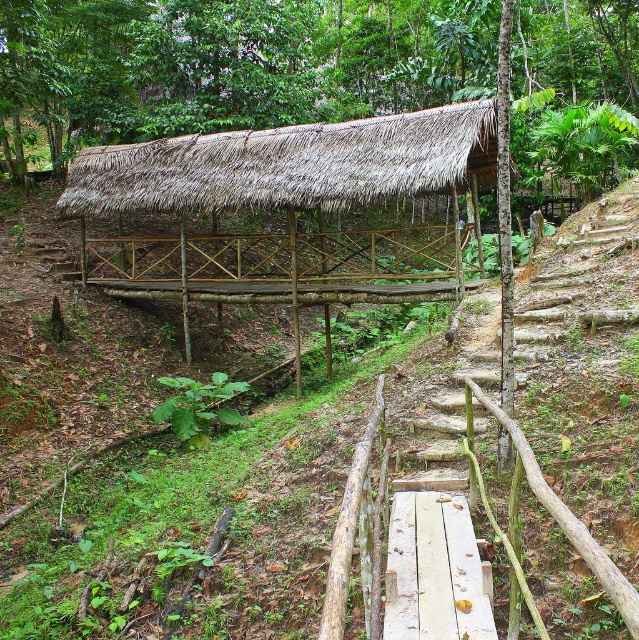
Question: Can you confirm if thatched roof hut at upper center is positioned below thatched roof shelter at center?

Choices:
 (A) no
 (B) yes

Answer: (A)

Question: Which of the following is the closest to the observer?

Choices:
 (A) thatched roof hut at upper center
 (B) thatched roof shelter at center

Answer: (B)

Question: Which point is closer to the camera taking this photo?

Choices:
 (A) (528, 10)
 (B) (273, 257)

Answer: (B)

Question: Which point is farther from the camera taking this photo?

Choices:
 (A) (82, 108)
 (B) (442, 262)

Answer: (A)

Question: Does thatched roof hut at upper center appear over thatched roof shelter at center?

Choices:
 (A) yes
 (B) no

Answer: (A)

Question: Does thatched roof hut at upper center lie in front of thatched roof shelter at center?

Choices:
 (A) yes
 (B) no

Answer: (B)